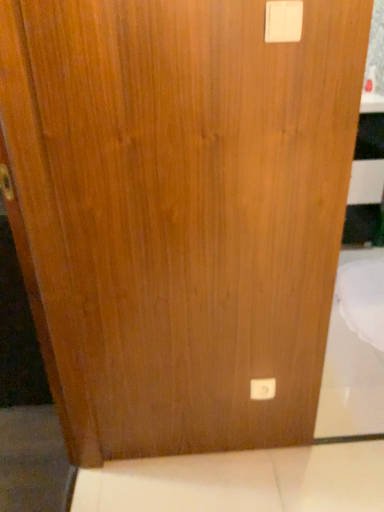
Question: Which direction should I rotate to look at white plastic light switch at lower center, marked as the 1th light switch in a bottom-to-top arrangement?

Choices:
 (A) right
 (B) left

Answer: (A)

Question: Does white plastic light switch at upper right, which ranks as the 1th light switch in front-to-back order, have a larger size compared to white plastic light switch at lower center, the second light switch from the top?

Choices:
 (A) yes
 (B) no

Answer: (B)

Question: Considering the relative positions of white plastic light switch at upper right, which is counted as the 2th light switch, starting from the bottom, and white plastic light switch at lower center, arranged as the first light switch when viewed from the back, in the image provided, is white plastic light switch at upper right, which is counted as the 2th light switch, starting from the bottom, in front of white plastic light switch at lower center, arranged as the first light switch when viewed from the back,?

Choices:
 (A) yes
 (B) no

Answer: (A)

Question: Is white plastic light switch at upper right, marked as the 2th light switch in a back-to-front arrangement, positioned beyond the bounds of white plastic light switch at lower center, arranged as the first light switch when viewed from the back?

Choices:
 (A) no
 (B) yes

Answer: (B)

Question: Could you tell me if white plastic light switch at upper right, marked as the 2th light switch in a back-to-front arrangement, is facing white plastic light switch at lower center, the second light switch from the top?

Choices:
 (A) no
 (B) yes

Answer: (A)

Question: Does white plastic light switch at upper right, marked as the first light switch in a top-to-bottom arrangement, lie behind white plastic light switch at lower center, the second light switch from the top?

Choices:
 (A) yes
 (B) no

Answer: (B)

Question: Can you confirm if white plastic light switch at upper right, which is counted as the 2th light switch, starting from the bottom, is shorter than white plastic light switch at lower center, arranged as the first light switch when viewed from the back?

Choices:
 (A) no
 (B) yes

Answer: (B)

Question: Does white plastic light switch at lower center, arranged as the first light switch when viewed from the back, come in front of white plastic light switch at upper right, marked as the first light switch in a top-to-bottom arrangement?

Choices:
 (A) no
 (B) yes

Answer: (A)

Question: Is white plastic light switch at lower center, the second light switch from the top, next to white plastic light switch at upper right, which is counted as the 2th light switch, starting from the bottom?

Choices:
 (A) yes
 (B) no

Answer: (B)

Question: Is white plastic light switch at upper right, which is counted as the 2th light switch, starting from the bottom, inside white plastic light switch at lower center, marked as the 1th light switch in a bottom-to-top arrangement?

Choices:
 (A) no
 (B) yes

Answer: (A)

Question: From the image's perspective, does white plastic light switch at lower center, marked as the 1th light switch in a bottom-to-top arrangement, appear higher than white plastic light switch at upper right, marked as the 2th light switch in a back-to-front arrangement?

Choices:
 (A) yes
 (B) no

Answer: (B)

Question: Can you confirm if white plastic light switch at lower center, marked as the 1th light switch in a bottom-to-top arrangement, is wider than white plastic light switch at upper right, which is counted as the 2th light switch, starting from the bottom?

Choices:
 (A) yes
 (B) no

Answer: (B)

Question: From a real-world perspective, is white plastic light switch at lower center, the second light switch from the front, on white plastic light switch at upper right, which ranks as the 1th light switch in front-to-back order?

Choices:
 (A) no
 (B) yes

Answer: (A)

Question: Would you say white plastic light switch at upper right, marked as the first light switch in a top-to-bottom arrangement, is to the left or to the right of white plastic light switch at lower center, marked as the 1th light switch in a bottom-to-top arrangement, in the picture?

Choices:
 (A) left
 (B) right

Answer: (A)